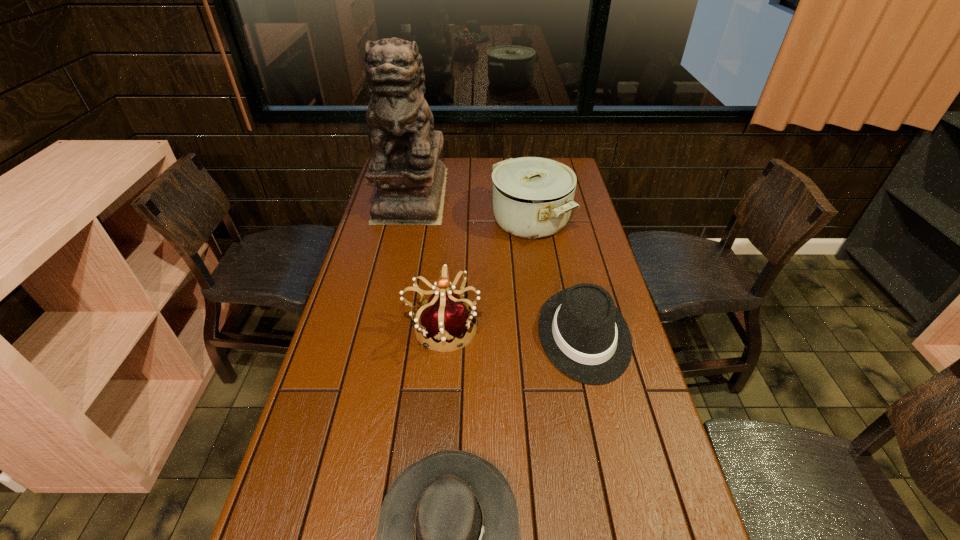
This screenshot has height=540, width=960. Identify the location of the tallest object. (405, 167).

Find the location of a particular element. The image size is (960, 540). tiara is located at coordinates (444, 316).

Identify the location of saucepan. (533, 197).

I want to click on fedora, so [x=585, y=336].

Locate an element on the screen. The image size is (960, 540). free space located on the front-facing side of the tallest object is located at coordinates (393, 280).

Find the location of a particular element. The image size is (960, 540). free space located on the front-facing side of the tiara is located at coordinates pos(533,328).

Locate an element on the screen. free space located on the left of the saucepan is located at coordinates (427, 220).

You are a GUI agent. You are given a task and a screenshot of the screen. Output one action in this format:
    pyautogui.click(x=<x>, y=<y>)
    Task: Click on the vacant space located 0.290m on the front-facing side of the fedora
    
    Given the screenshot: What is the action you would take?
    pyautogui.click(x=623, y=507)

At what (x,y) coordinates should I click in order to perform the action: click on object at the far edge. Please return your answer as a coordinate pair (x, y). The height and width of the screenshot is (540, 960). Looking at the image, I should click on (405, 167).

In order to click on object that is at the left edge in this screenshot , I will do `click(405, 167)`.